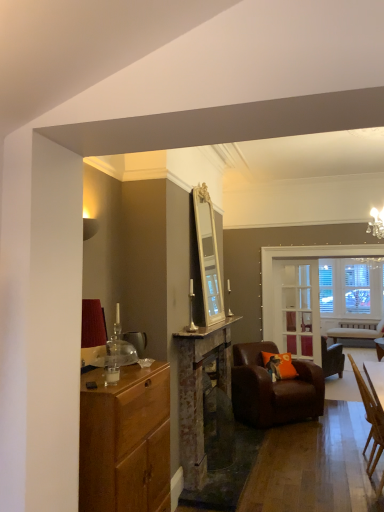
Question: Is wooden cabinet at left inside or outside of brown leather armchair at center, placed as the 1th chair when sorted from back to front?

Choices:
 (A) outside
 (B) inside

Answer: (A)

Question: Visually, is wooden cabinet at left positioned to the left or to the right of brown leather armchair at center, the third chair when ordered from front to back?

Choices:
 (A) left
 (B) right

Answer: (A)

Question: Estimate the real-world distances between objects in this image. Which object is farther from the clear glass door at center?

Choices:
 (A) brown leather armchair at center, the third chair when ordered from front to back
 (B) brown leather armchair at center, which is the second chair in front-to-back order
 (C) light brown wooden chair at lower right, the first chair positioned from the front
 (D) orange fabric pillow at lower center
 (E) rustic stone fireplace at center

Answer: (C)

Question: Which object is the farthest from the clear glass door at center?

Choices:
 (A) light brown wooden chair at lower right, the first chair positioned from the front
 (B) marble counter top at center
 (C) brown leather armchair at center, placed as the 1th chair when sorted from back to front
 (D) brown leather armchair at center, the 2th chair viewed from the back
 (E) rustic stone fireplace at center

Answer: (A)